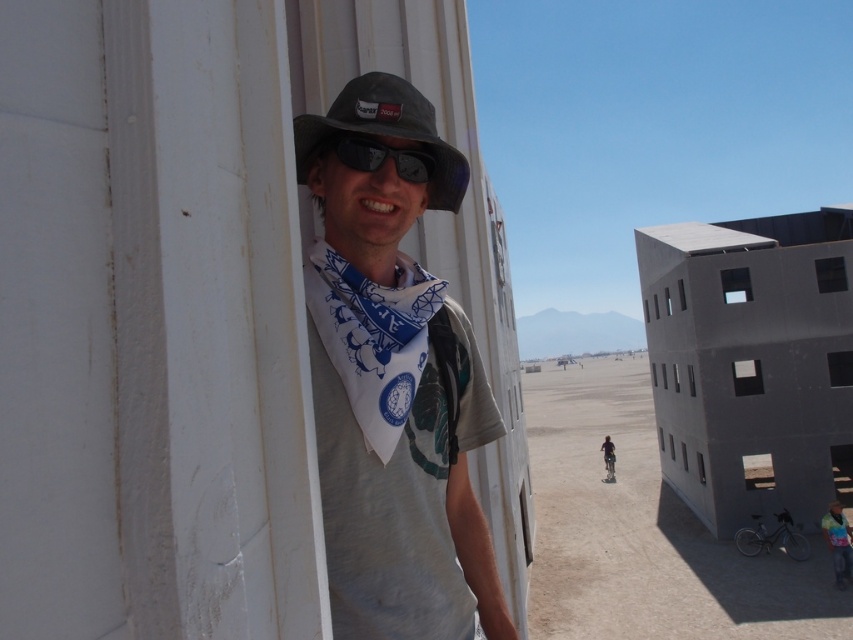
Find the location of a particular element. The image size is (853, 640). white cotton bandana at center is located at coordinates (393, 385).

The height and width of the screenshot is (640, 853). What do you see at coordinates (393, 385) in the screenshot? I see `white cotton bandana at center` at bounding box center [393, 385].

I want to click on white cotton bandana at center, so click(x=393, y=385).

This screenshot has width=853, height=640. Find the location of `white cotton bandana at center`. white cotton bandana at center is located at coordinates (393, 385).

Who is positioned more to the right, white cotton bandana at center or matte black hat at center?

From the viewer's perspective, white cotton bandana at center appears more on the right side.

Is white cotton bandana at center above matte black hat at center?

No, white cotton bandana at center is not above matte black hat at center.

Between point (392, 93) and point (404, 108), which one is positioned in front?

Point (404, 108) is in front.

Where is `white cotton bandana at center`? This screenshot has height=640, width=853. white cotton bandana at center is located at coordinates (393, 385).

Who is positioned more to the right, white printed scarf at center or matte gray shirt at center?

matte gray shirt at center is more to the right.

Looking at this image, does white printed scarf at center appear over matte gray shirt at center?

Correct, white printed scarf at center is located above matte gray shirt at center.

Image resolution: width=853 pixels, height=640 pixels. Find the location of `white printed scarf at center`. white printed scarf at center is located at coordinates (379, 340).